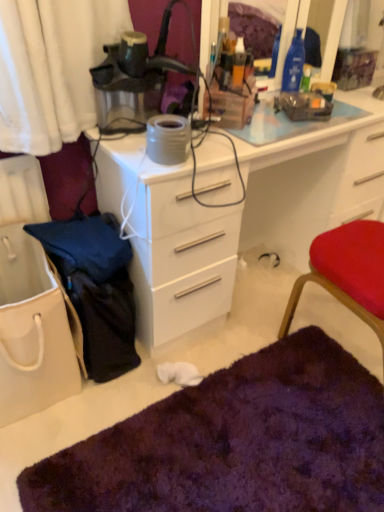
Question: Considering the relative sizes of matte black lamp at upper center and purple shaggy rug at lower center in the image provided, is matte black lamp at upper center smaller than purple shaggy rug at lower center?

Choices:
 (A) no
 (B) yes

Answer: (B)

Question: Is matte black lamp at upper center in front of purple shaggy rug at lower center?

Choices:
 (A) yes
 (B) no

Answer: (B)

Question: Considering the relative positions of matte black lamp at upper center and purple shaggy rug at lower center in the image provided, is matte black lamp at upper center to the right of purple shaggy rug at lower center from the viewer's perspective?

Choices:
 (A) yes
 (B) no

Answer: (B)

Question: Is matte black lamp at upper center shorter than purple shaggy rug at lower center?

Choices:
 (A) no
 (B) yes

Answer: (A)

Question: Can you confirm if matte black lamp at upper center is wider than purple shaggy rug at lower center?

Choices:
 (A) yes
 (B) no

Answer: (B)

Question: In terms of height, does purple shaggy rug at lower center look taller or shorter compared to matte gray coffee cup at upper right?

Choices:
 (A) short
 (B) tall

Answer: (B)

Question: From a real-world perspective, is purple shaggy rug at lower center positioned above or below matte gray coffee cup at upper right?

Choices:
 (A) below
 (B) above

Answer: (A)

Question: Is purple shaggy rug at lower center spatially inside matte gray coffee cup at upper right, or outside of it?

Choices:
 (A) inside
 (B) outside

Answer: (B)

Question: Visually, is purple shaggy rug at lower center positioned to the left or to the right of matte gray coffee cup at upper right?

Choices:
 (A) right
 (B) left

Answer: (B)

Question: Relative to white glossy desk at center, is white canvas tote bag at lower left in front or behind?

Choices:
 (A) behind
 (B) front

Answer: (B)

Question: Considering the positions of white canvas tote bag at lower left and white glossy desk at center in the image, is white canvas tote bag at lower left bigger or smaller than white glossy desk at center?

Choices:
 (A) big
 (B) small

Answer: (B)

Question: From their relative heights in the image, would you say white canvas tote bag at lower left is taller or shorter than white glossy desk at center?

Choices:
 (A) short
 (B) tall

Answer: (A)

Question: From a real-world perspective, is white canvas tote bag at lower left positioned above or below white glossy desk at center?

Choices:
 (A) below
 (B) above

Answer: (A)

Question: Visually, is white glossy desk at center positioned to the left or to the right of purple shaggy rug at lower center?

Choices:
 (A) left
 (B) right

Answer: (B)

Question: From a real-world perspective, is white glossy desk at center physically located above or below purple shaggy rug at lower center?

Choices:
 (A) below
 (B) above

Answer: (B)